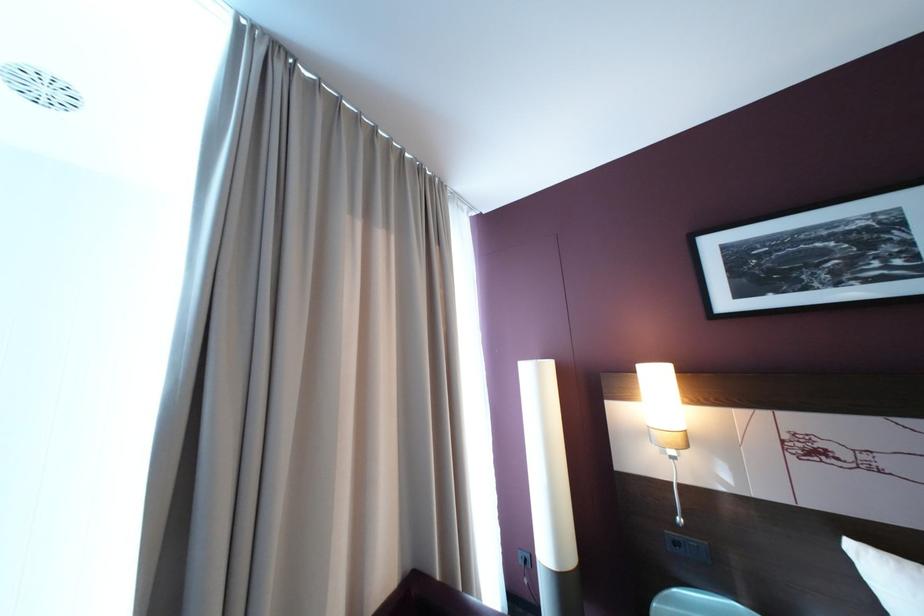
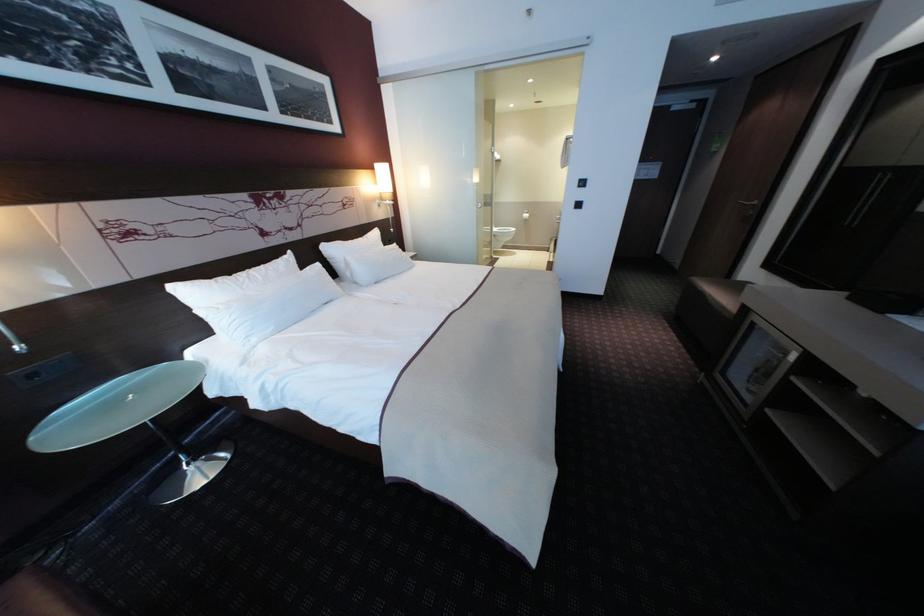
How did the camera likely rotate?

The camera rotated toward right-down.